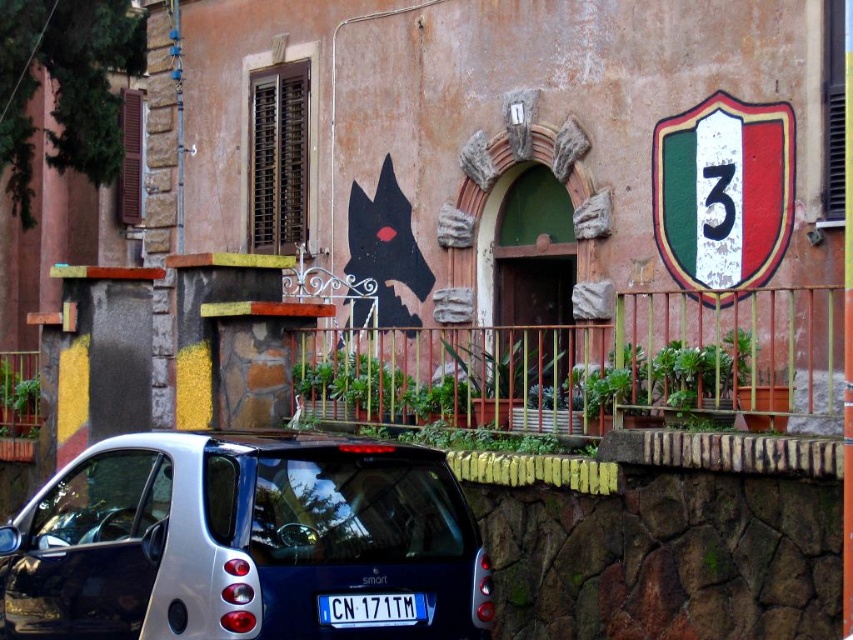
You are a delivery driver who needs to attach a new license plate to your vehicle. The current one is the white plastic license plate at center. You have a new one that is the painted metal shield at upper right. Can you use the new license plate in place of the old one without any modifications?

The painted metal shield at upper right is bigger than the white plastic license plate at center, so you cannot use it without modifying the mounting bracket to accommodate its larger size.

You are a delivery driver who needs to park your metallic blue car at lower left near the painted metal shield at upper right. Based on the scene, can you park the car directly underneath the shield?

Yes, the metallic blue car at lower left is positioned below the painted metal shield at upper right, so parking directly underneath it is possible.

Consider the image. You are a delivery driver who needs to park your metallic blue car at lower left in a specific spot marked at coordinate point 0.845, 0.283. Can you confirm if your current position matches the required parking spot?

Yes, the metallic blue car at lower left is already positioned at the required coordinate point (241, 540).